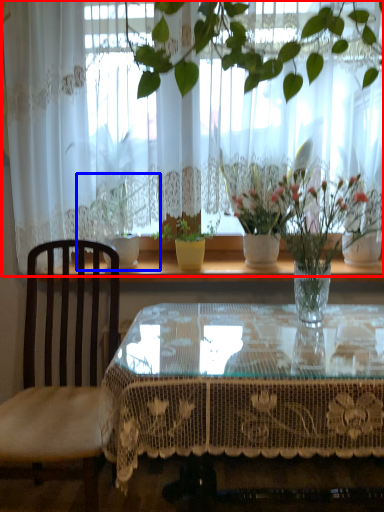
Question: Which of the following is the closest to the observer, curtain (highlighted by a red box) or houseplant (highlighted by a blue box)?

Choices:
 (A) curtain
 (B) houseplant

Answer: (A)